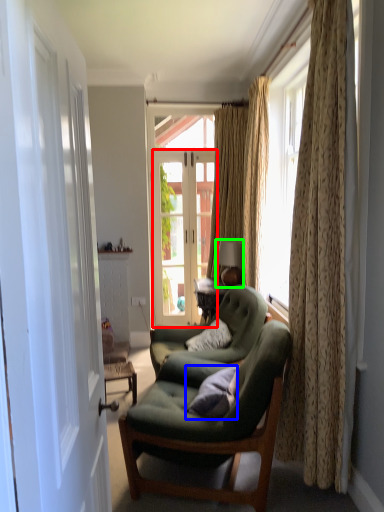
Question: Considering the real-world distances, which object is closest to door (highlighted by a red box)? pillow (highlighted by a blue box) or lamp (highlighted by a green box).

Choices:
 (A) pillow
 (B) lamp

Answer: (B)